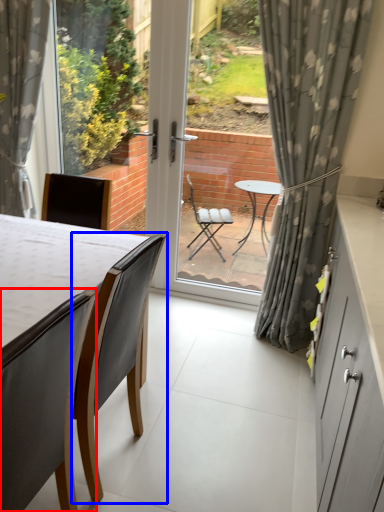
Question: Which object is closer to the camera taking this photo, chair (highlighted by a red box) or chair (highlighted by a blue box)?

Choices:
 (A) chair
 (B) chair

Answer: (A)